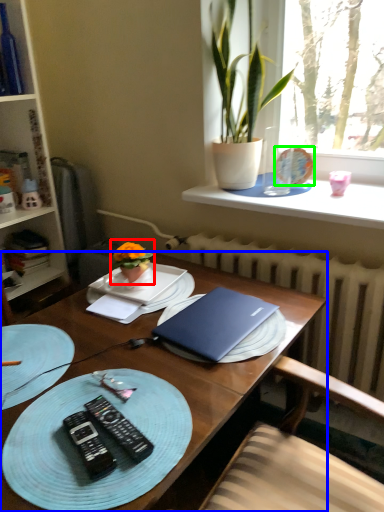
Question: Which is nearer to the houseplant (highlighted by a red box)? desk (highlighted by a blue box) or tableware (highlighted by a green box).

Choices:
 (A) desk
 (B) tableware

Answer: (A)